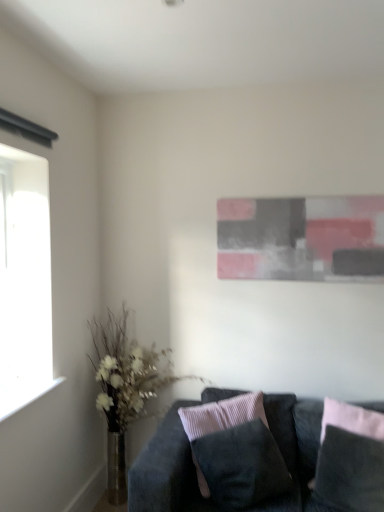
Image resolution: width=384 pixels, height=512 pixels. Describe the element at coordinates (124, 388) in the screenshot. I see `translucent glass vase at left` at that location.

Image resolution: width=384 pixels, height=512 pixels. Describe the element at coordinates (24, 280) in the screenshot. I see `transparent glass window at left` at that location.

Where is `transparent glass window at left`? The image size is (384, 512). transparent glass window at left is located at coordinates (24, 280).

Measure the distance between point (x=198, y=433) and camera.

The distance of point (x=198, y=433) from camera is 7.09 feet.

Where is `abstract painting at upper center`? abstract painting at upper center is located at coordinates (301, 238).

This screenshot has width=384, height=512. What do you see at coordinates (170, 466) in the screenshot?
I see `suede black couch at lower right` at bounding box center [170, 466].

Identify the location of suede black couch at lower right. The height and width of the screenshot is (512, 384). (170, 466).

Image resolution: width=384 pixels, height=512 pixels. I want to click on translucent glass vase at left, so click(124, 388).

What's the angular difference between velvet dark gray pillow at lower right, which appears as the 1th pillow when viewed from the right, and suede black couch at lower right's facing directions?

21.2 degrees.

Considering the relative sizes of velvet dark gray pillow at lower right, which ranks as the 2th pillow in left-to-right order, and suede black couch at lower right in the image provided, is velvet dark gray pillow at lower right, which ranks as the 2th pillow in left-to-right order, wider than suede black couch at lower right?

No.

Is velvet dark gray pillow at lower right, which appears as the 1th pillow when viewed from the right, facing away from suede black couch at lower right?

Absolutely, velvet dark gray pillow at lower right, which appears as the 1th pillow when viewed from the right, is directed away from suede black couch at lower right.

Is velvet dark gray pillow at lower right, which ranks as the 2th pillow in left-to-right order, spatially inside suede black couch at lower right, or outside of it?

velvet dark gray pillow at lower right, which ranks as the 2th pillow in left-to-right order, is contained in suede black couch at lower right.

Is point (196, 412) positioned in front of point (337, 262)?

Yes, point (196, 412) is in front of point (337, 262).

Does suede-like black pillow at center, the 2th pillow from the right, have a smaller size compared to abstract painting at upper center?

Actually, suede-like black pillow at center, the 2th pillow from the right, might be larger than abstract painting at upper center.

Is the surface of suede-like black pillow at center, the 2th pillow from the right, in direct contact with abstract painting at upper center?

No, suede-like black pillow at center, the 2th pillow from the right, is not touching abstract painting at upper center.

Consider the image. Is suede-like black pillow at center, which is the 1th pillow from left to right, at the left side of abstract painting at upper center?

Yes, suede-like black pillow at center, which is the 1th pillow from left to right, is to the left of abstract painting at upper center.

Is translucent glass vase at left surrounded by transparent glass window at left?

No.

Is point (50, 370) positioned before point (98, 344)?

Yes, point (50, 370) is in front of point (98, 344).

How many degrees apart are the facing directions of transparent glass window at left and translucent glass vase at left?

They differ by 90.2 degrees in their facing directions.

Is transparent glass window at left wider or thinner than translucent glass vase at left?

Considering their sizes, transparent glass window at left looks slimmer than translucent glass vase at left.

From the picture: Is suede black couch at lower right spatially inside suede-like black pillow at center, which is the 1th pillow from left to right, or outside of it?

suede black couch at lower right exists outside the volume of suede-like black pillow at center, which is the 1th pillow from left to right.

Is suede black couch at lower right to the right of suede-like black pillow at center, the 2th pillow from the right, from the viewer's perspective?

Correct, you'll find suede black couch at lower right to the right of suede-like black pillow at center, the 2th pillow from the right.

Considering the positions of points (173, 420) and (212, 431), is point (173, 420) farther from camera compared to point (212, 431)?

Yes, point (173, 420) is behind point (212, 431).

Considering the positions of points (101, 398) and (250, 406), is point (101, 398) farther from camera compared to point (250, 406)?

That is True.

Where is `the 2nd pillow in front of the translucent glass vase at left, counting from the anchor's position`? The image size is (384, 512). the 2nd pillow in front of the translucent glass vase at left, counting from the anchor's position is located at coordinates (222, 415).

Does translucent glass vase at left have a lesser height compared to suede-like black pillow at center, which is the 1th pillow from left to right?

No.

Relative to suede-like black pillow at center, the 2th pillow from the right, is translucent glass vase at left in front or behind?

translucent glass vase at left is behind suede-like black pillow at center, the 2th pillow from the right.

Considering the sizes of objects translucent glass vase at left and velvet dark gray pillow at lower right, which appears as the 1th pillow when viewed from the right, in the image provided, who is wider, translucent glass vase at left or velvet dark gray pillow at lower right, which appears as the 1th pillow when viewed from the right,?

translucent glass vase at left is wider.

Is translucent glass vase at left not within velvet dark gray pillow at lower right, which appears as the 1th pillow when viewed from the right?

Yes, translucent glass vase at left is located beyond the bounds of velvet dark gray pillow at lower right, which appears as the 1th pillow when viewed from the right.

Is point (140, 392) less distant than point (333, 431)?

No, it is not.

From the picture: Between suede-like black pillow at center, the 2th pillow from the right, and translucent glass vase at left, which one has smaller width?

suede-like black pillow at center, the 2th pillow from the right.

Considering the positions of objects suede-like black pillow at center, which is the 1th pillow from left to right, and translucent glass vase at left in the image provided, who is more to the right, suede-like black pillow at center, which is the 1th pillow from left to right, or translucent glass vase at left?

From the viewer's perspective, suede-like black pillow at center, which is the 1th pillow from left to right, appears more on the right side.

Considering the relative sizes of suede-like black pillow at center, which is the 1th pillow from left to right, and translucent glass vase at left in the image provided, is suede-like black pillow at center, which is the 1th pillow from left to right, shorter than translucent glass vase at left?

Yes, suede-like black pillow at center, which is the 1th pillow from left to right, is shorter than translucent glass vase at left.

From a real-world perspective, which object rests below the other?

suede-like black pillow at center, which is the 1th pillow from left to right.

This screenshot has height=512, width=384. I want to click on studio couch below the velvet dark gray pillow at lower right, which appears as the 1th pillow when viewed from the right (from the image's perspective), so click(x=170, y=466).

Image resolution: width=384 pixels, height=512 pixels. There is a abstract painting at upper center. In order to click on the 2nd pillow below it (from a real-world perspective) in this screenshot , I will do `click(222, 415)`.

When comparing their distances from transparent glass window at left, does abstract painting at upper center or velvet dark gray pillow at lower right, which ranks as the 2th pillow in left-to-right order, seem closer?

Among the two, abstract painting at upper center is located nearer to transparent glass window at left.

Looking at the image, which one is located further to suede black couch at lower right, transparent glass window at left or suede-like black pillow at center, the 2th pillow from the right?

The object further to suede black couch at lower right is transparent glass window at left.

In the scene shown: Which object lies further to the anchor point velvet dark gray pillow at lower right, which ranks as the 2th pillow in left-to-right order, abstract painting at upper center or translucent glass vase at left?

Among the two, translucent glass vase at left is located further to velvet dark gray pillow at lower right, which ranks as the 2th pillow in left-to-right order.

Considering their positions, is suede black couch at lower right positioned closer to translucent glass vase at left than velvet dark gray pillow at lower right, which appears as the 1th pillow when viewed from the right?

suede black couch at lower right.

Based on their spatial positions, is translucent glass vase at left or velvet dark gray pillow at lower right, which appears as the 1th pillow when viewed from the right, further from abstract painting at upper center?

Answer: velvet dark gray pillow at lower right, which appears as the 1th pillow when viewed from the right.

Looking at the image, which one is located closer to suede black couch at lower right, transparent glass window at left or translucent glass vase at left?

translucent glass vase at left is positioned closer to the anchor suede black couch at lower right.

Which object lies nearer to the anchor point abstract painting at upper center, transparent glass window at left or velvet dark gray pillow at lower right, which ranks as the 2th pillow in left-to-right order?

velvet dark gray pillow at lower right, which ranks as the 2th pillow in left-to-right order.

Looking at the image, which one is located closer to suede black couch at lower right, velvet dark gray pillow at lower right, which appears as the 1th pillow when viewed from the right, or transparent glass window at left?

velvet dark gray pillow at lower right, which appears as the 1th pillow when viewed from the right, is positioned closer to the anchor suede black couch at lower right.

Find the location of a particular element. Image resolution: width=384 pixels, height=512 pixels. houseplant between transparent glass window at left and suede black couch at lower right is located at coordinates (124, 388).

Where is `studio couch located between transparent glass window at left and velvet dark gray pillow at lower right, which appears as the 1th pillow when viewed from the right, in the left-right direction`? This screenshot has height=512, width=384. studio couch located between transparent glass window at left and velvet dark gray pillow at lower right, which appears as the 1th pillow when viewed from the right, in the left-right direction is located at coordinates (170, 466).

Locate an element on the screen. picture frame situated between transparent glass window at left and velvet dark gray pillow at lower right, which ranks as the 2th pillow in left-to-right order, from left to right is located at coordinates (301, 238).

This screenshot has width=384, height=512. Identify the location of houseplant situated between transparent glass window at left and abstract painting at upper center from left to right. (124, 388).